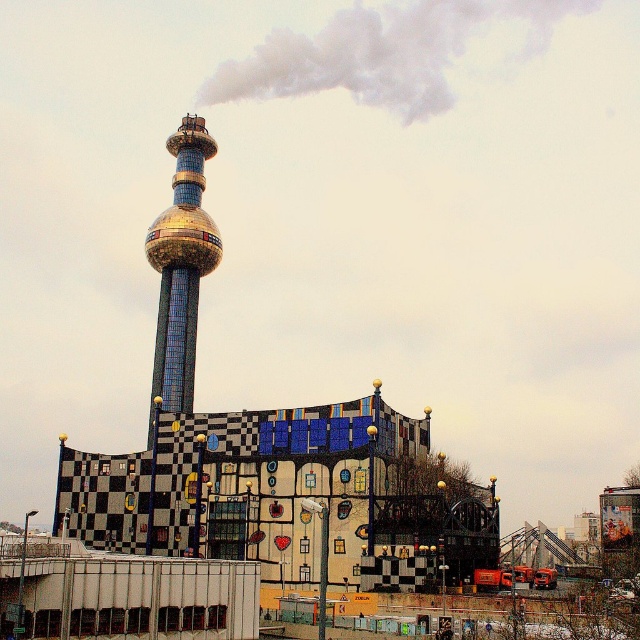
Between white smoke at upper center and gold mosaic tower at center, which one has less height?

With less height is white smoke at upper center.

Does white smoke at upper center have a lesser width compared to gold mosaic tower at center?

Incorrect, white smoke at upper center's width is not less than gold mosaic tower at center's.

The height and width of the screenshot is (640, 640). Find the location of `white smoke at upper center`. white smoke at upper center is located at coordinates (381, 52).